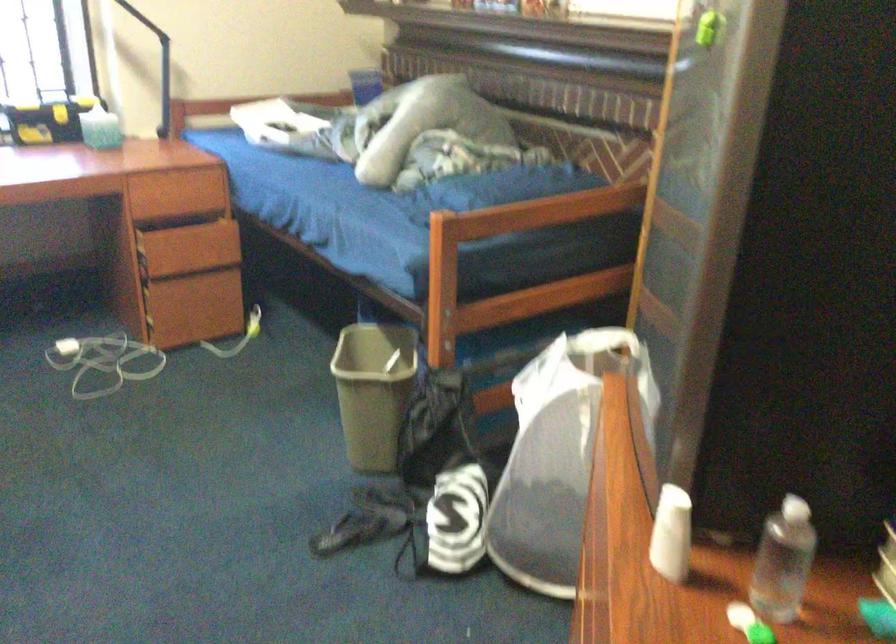
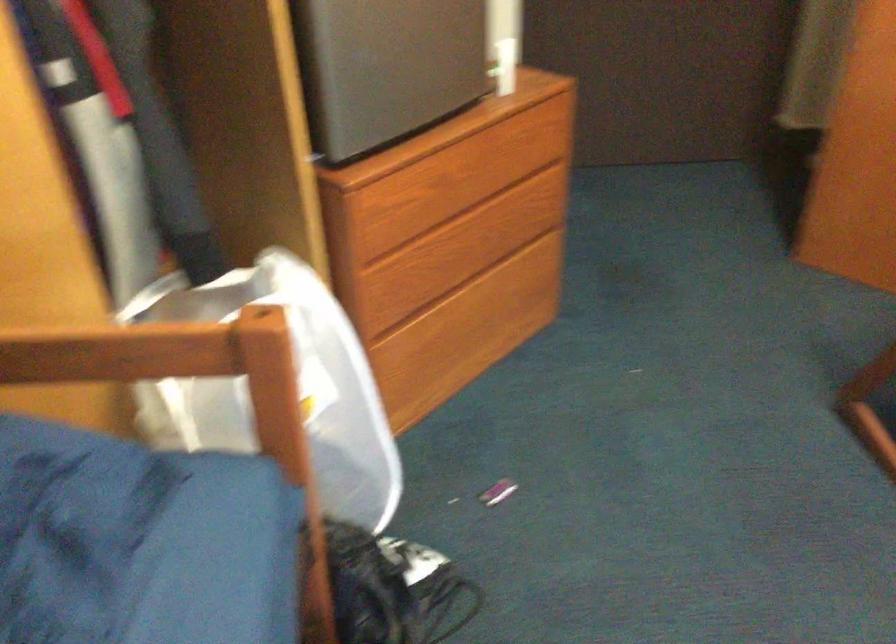
In the second image, find the point that corresponds to the point at 461,223 in the first image.

(73, 529)